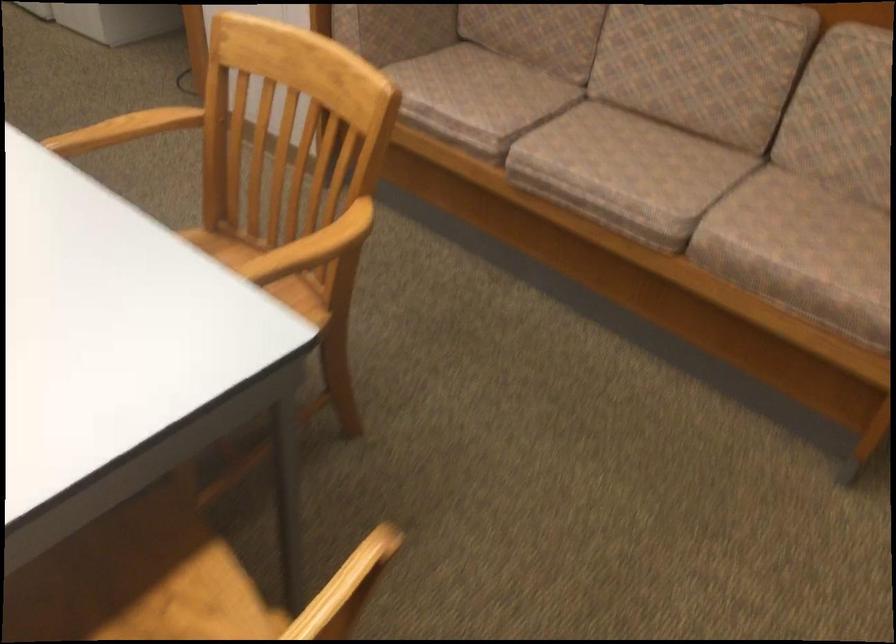
At what (x,y) coordinates should I click in order to perform the action: click on sofa sitting surface. Please return your answer as a coordinate pair (x, y). Looking at the image, I should click on (604, 140).